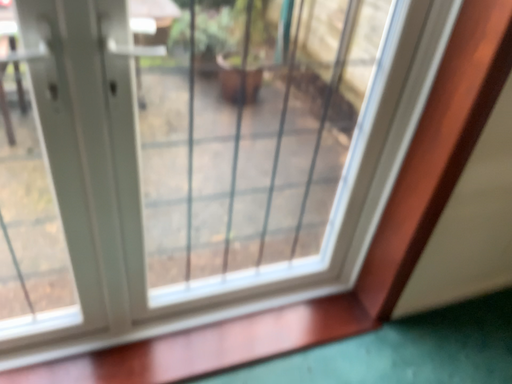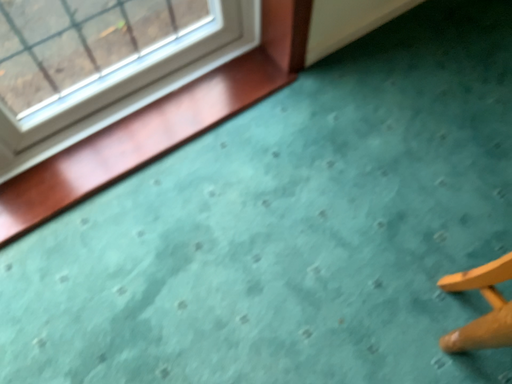
Question: Which way did the camera rotate in the video?

Choices:
 (A) rotated upward
 (B) rotated downward

Answer: (B)